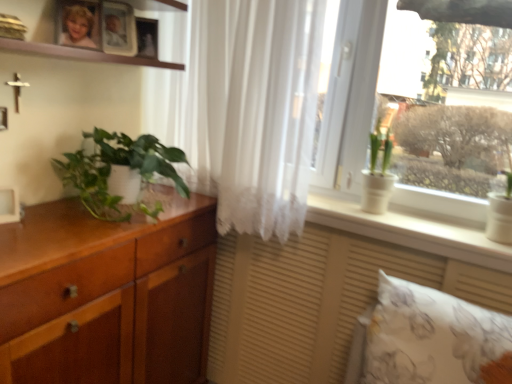
Question: Looking at the image, does white sheer curtain at center seem bigger or smaller compared to blonde hair photo at upper left?

Choices:
 (A) big
 (B) small

Answer: (A)

Question: From the image's perspective, is white sheer curtain at center positioned above or below blonde hair photo at upper left?

Choices:
 (A) below
 (B) above

Answer: (A)

Question: Which of these objects is positioned closest to the matte wooden picture frame at upper center, which is counted as the 3th picture frame, starting from the bottom?

Choices:
 (A) white floral fabric pillow at lower right
 (B) white ceramic pot at window, the second houseplant when ordered from left to right
 (C) white sheer curtain at center
 (D) matte wood vanity at lower center
 (E) white matte picture frame at left, the 3th picture frame viewed from the top

Answer: (C)

Question: Which object is positioned closest to the wooden cabinet at left?

Choices:
 (A) white matte picture frame at left, the third picture frame from the back
 (B) white ceramic pot at window, the second houseplant when ordered from left to right
 (C) matte wooden picture frame at upper center, which is the third picture frame in front-to-back order
 (D) wooden picture frame at upper center, which is counted as the 2th picture frame, starting from the right
 (E) blonde hair photo at upper left

Answer: (A)